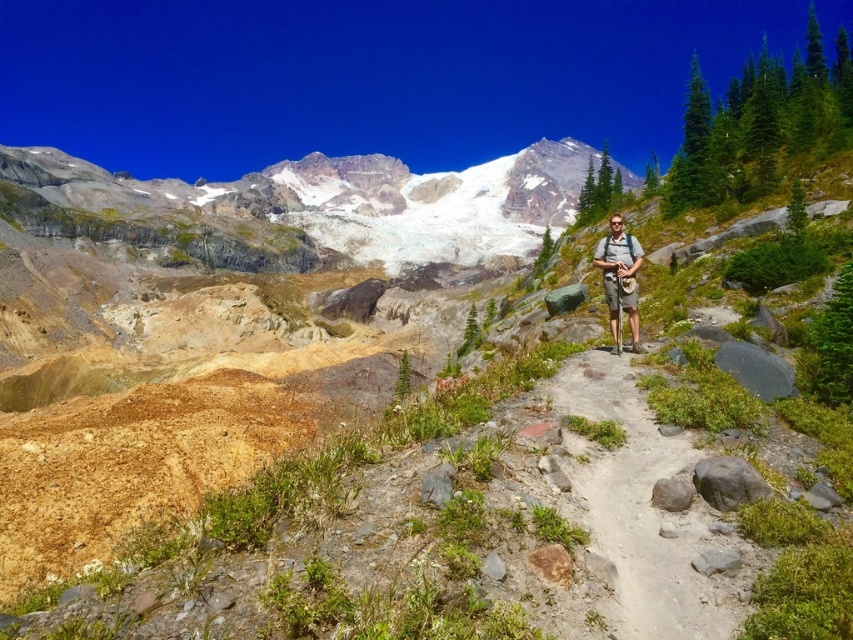
Question: Is dirt/gravel path at center smaller than gray fabric backpack at center?

Choices:
 (A) yes
 (B) no

Answer: (B)

Question: Which of the following is the closest to the observer?

Choices:
 (A) gray fabric backpack at center
 (B) dirt/gravel path at center

Answer: (B)

Question: Is dirt/gravel path at center bigger than gray fabric backpack at center?

Choices:
 (A) no
 (B) yes

Answer: (B)

Question: Does dirt/gravel path at center have a larger size compared to gray fabric backpack at center?

Choices:
 (A) yes
 (B) no

Answer: (A)

Question: Which of the following is the farthest from the observer?

Choices:
 (A) dirt/gravel path at center
 (B) gray fabric backpack at center

Answer: (B)

Question: Among these objects, which one is farthest from the camera?

Choices:
 (A) gray fabric backpack at center
 (B) dirt/gravel path at center

Answer: (A)